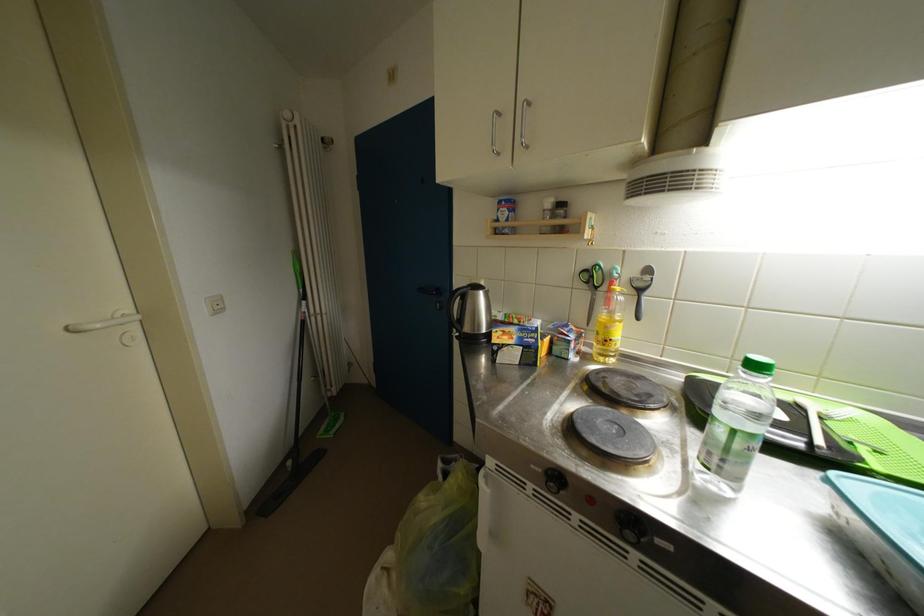
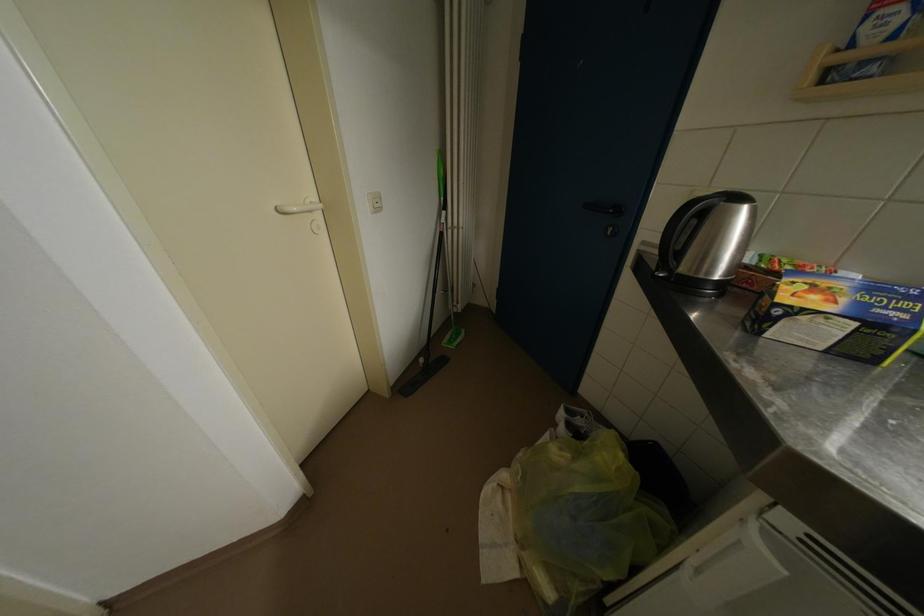
In the second image, find the point that corresponds to [310,302] in the first image.

(451, 211)